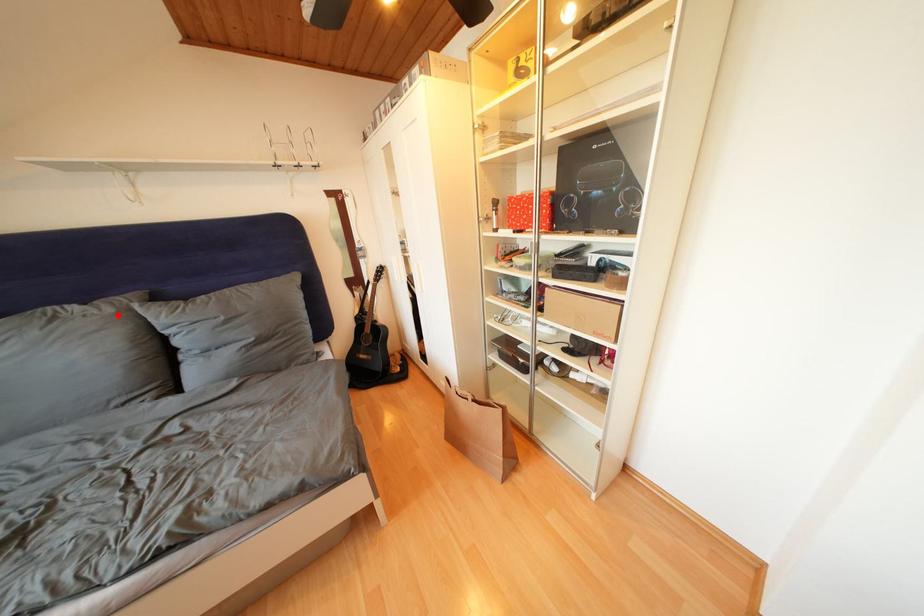
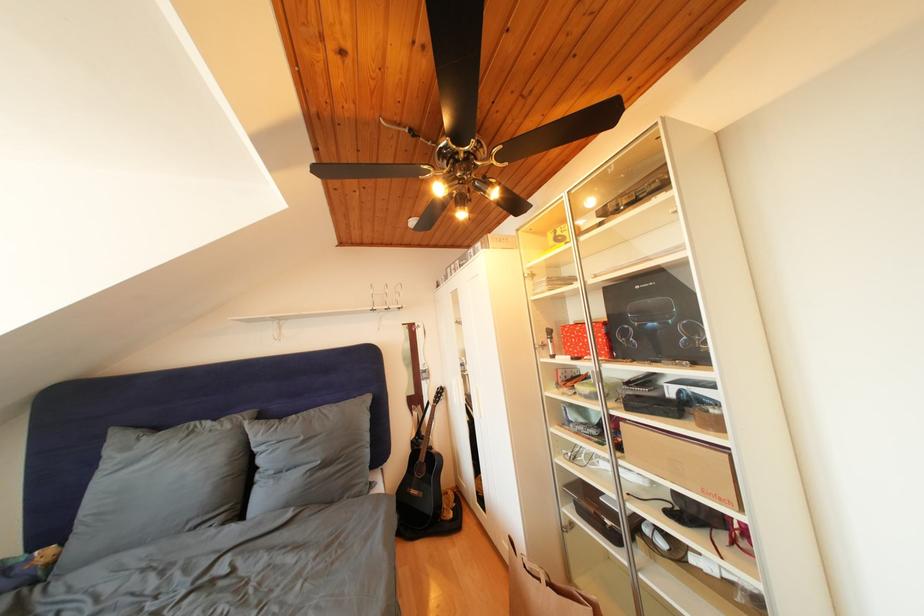
Find the pixel in the second image that matches the highlighted location in the first image.

(236, 432)